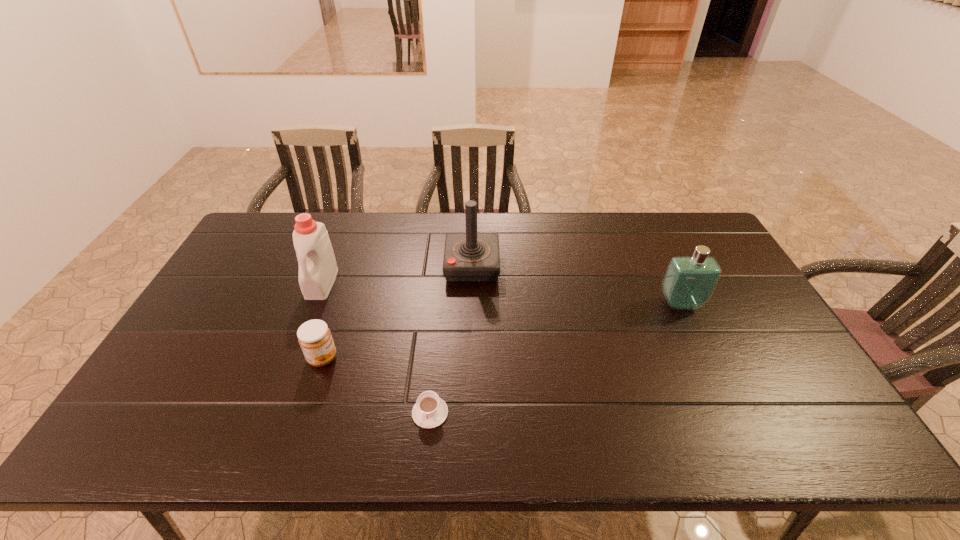
Image resolution: width=960 pixels, height=540 pixels. What are the coordinates of `object that is the third closest to the rightmost object` in the screenshot? It's located at (314, 337).

Identify which object is the nearest to the third tallest object. Please provide its 2D coordinates. Your answer should be formatted as a tuple, i.e. [(x, y)], where the tuple contains the x and y coordinates of a point satisfying the conditions above.

[(471, 257)]

Where is `free spot that satisfies the following two spatial constraints: 1. on the rectangular base of the joystick; 2. on the handle side of the shortest object`? free spot that satisfies the following two spatial constraints: 1. on the rectangular base of the joystick; 2. on the handle side of the shortest object is located at coordinates (469, 413).

The width and height of the screenshot is (960, 540). Identify the location of free spot that satisfies the following two spatial constraints: 1. on the front label of the rightmost object; 2. on the front label of the fourth tallest object. (707, 358).